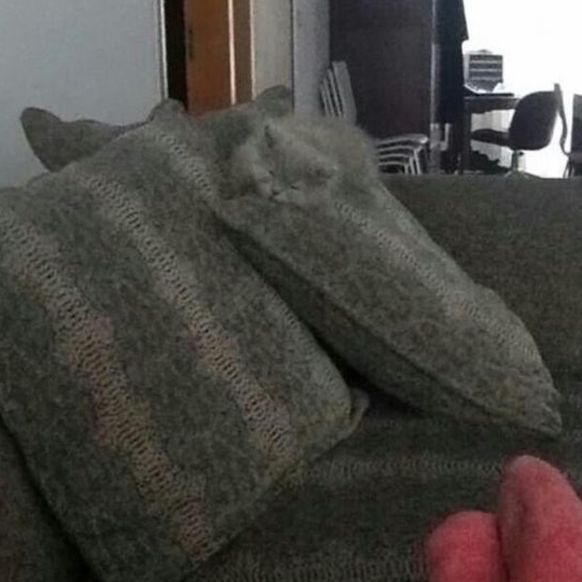
Locate an element on the screen. Image resolution: width=582 pixels, height=582 pixels. doorway is located at coordinates (201, 30).